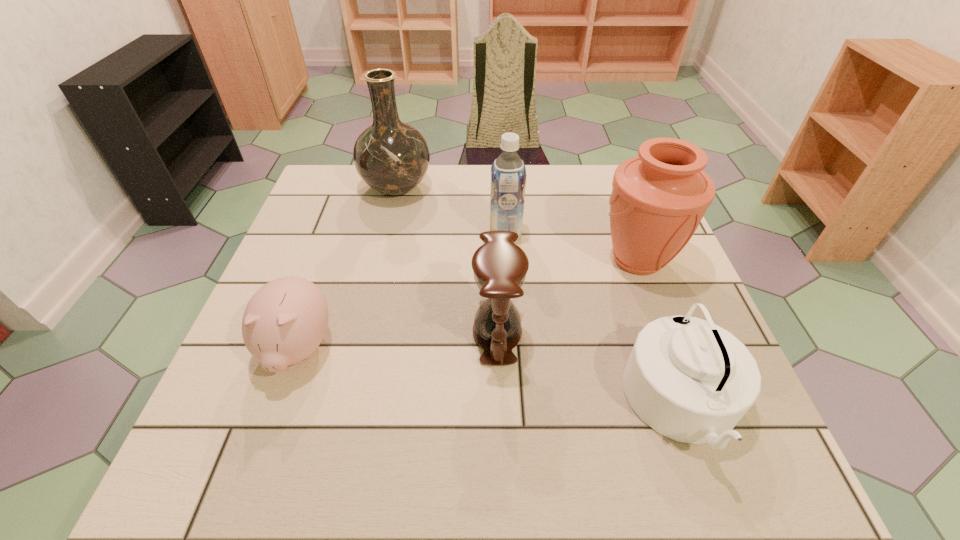
Locate an element on the screen. vacant space located 0.230m on the label of the soya milk is located at coordinates (400, 233).

Identify the location of vacant area situated 0.290m on the label of the soya milk. The image size is (960, 540). (376, 233).

You are a GUI agent. You are given a task and a screenshot of the screen. Output one action in this format:
    pyautogui.click(x=<x>, y=<y>)
    Task: Click on the free region located 0.050m on the front of the hourglass
    The width and height of the screenshot is (960, 540).
    Given the screenshot: What is the action you would take?
    pyautogui.click(x=499, y=391)

Find the location of a particular element. This screenshot has height=540, width=960. blank space located 0.190m on the spout of the kettle is located at coordinates (520, 404).

You are a GUI agent. You are given a task and a screenshot of the screen. Output one action in this format:
    pyautogui.click(x=<x>, y=<y>)
    Task: Click on the free region located 0.120m on the spout of the kettle
    This screenshot has height=540, width=960.
    Given the screenshot: What is the action you would take?
    pyautogui.click(x=560, y=404)

I want to click on vacant point located 0.370m on the spout of the kettle, so click(x=420, y=404).

The width and height of the screenshot is (960, 540). Identify the location of vacant point located at the snout of the shortest object. (268, 434).

The image size is (960, 540). In order to click on object present at the far edge in this screenshot , I will do `click(392, 157)`.

Find the location of `object that is at the near edge`. object that is at the near edge is located at coordinates (690, 380).

This screenshot has width=960, height=540. I want to click on vase positioned at the left edge, so click(x=392, y=157).